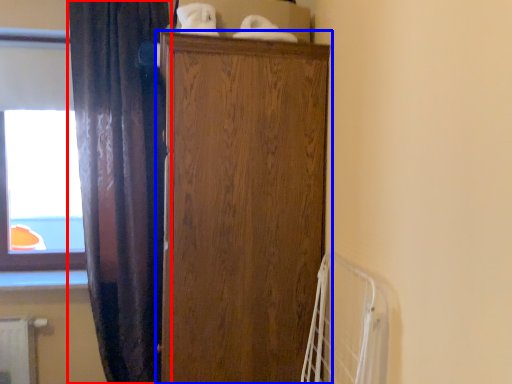
Question: Which object is further to the camera taking this photo, curtain (highlighted by a red box) or cupboard (highlighted by a blue box)?

Choices:
 (A) curtain
 (B) cupboard

Answer: (A)